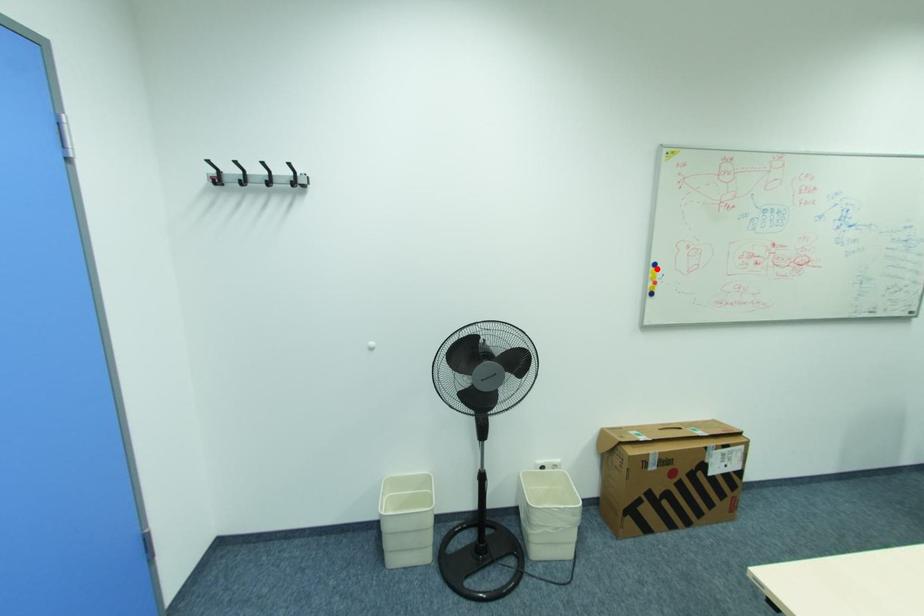
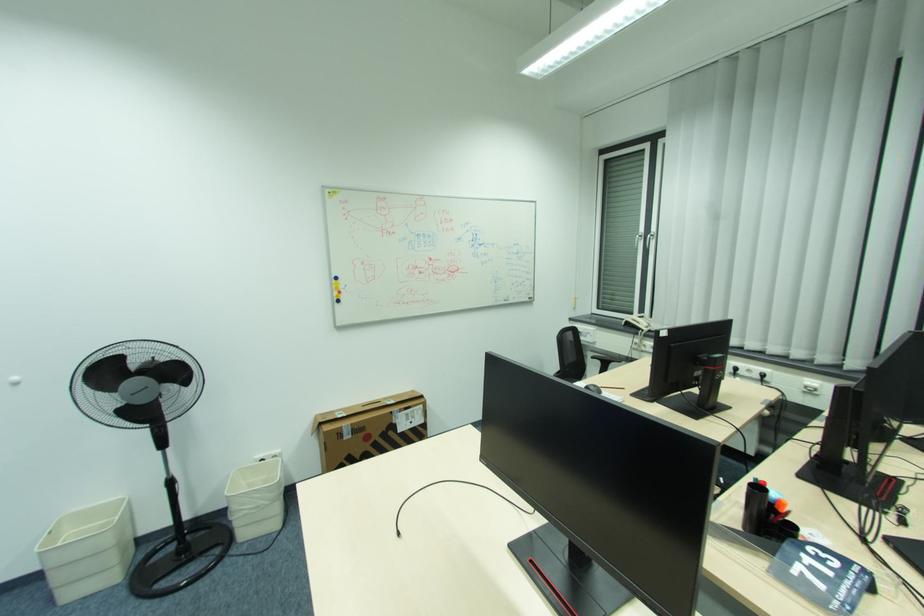
Find the pixel in the second image that matches the highlighted location in the first image.

(339, 282)